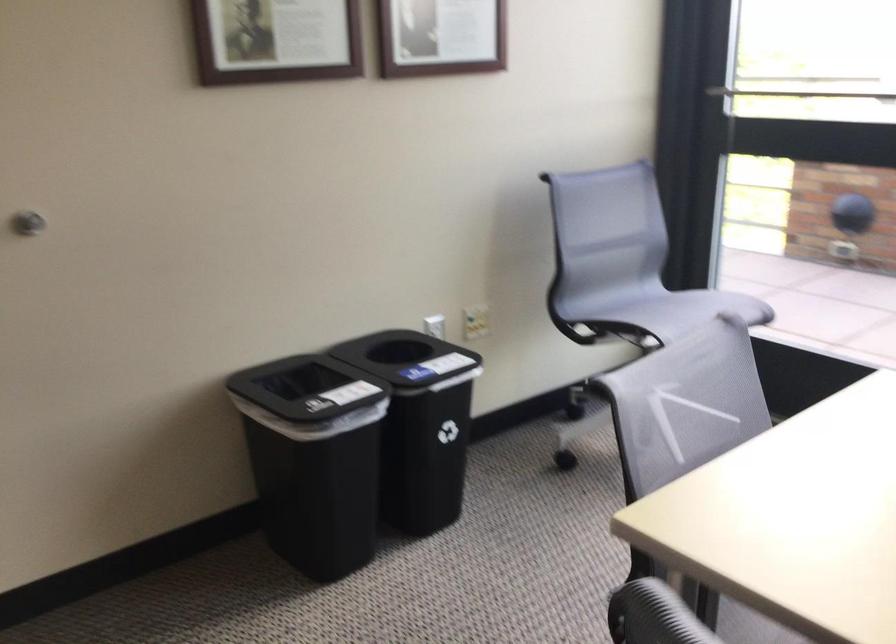
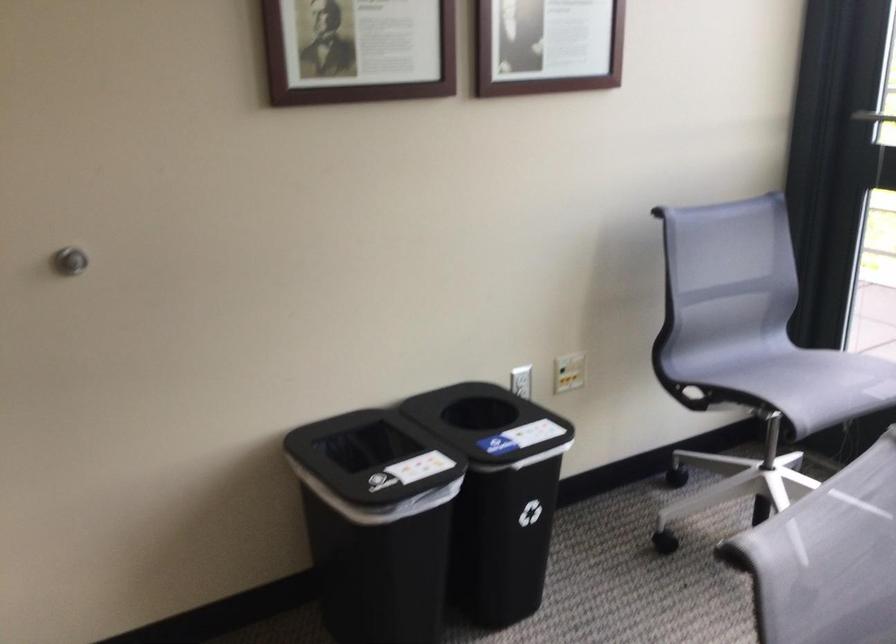
Question: In a continuous first-person perspective shot, in which direction is the camera moving?

Choices:
 (A) Left
 (B) Right
 (C) Forward
 (D) Backward

Answer: (C)